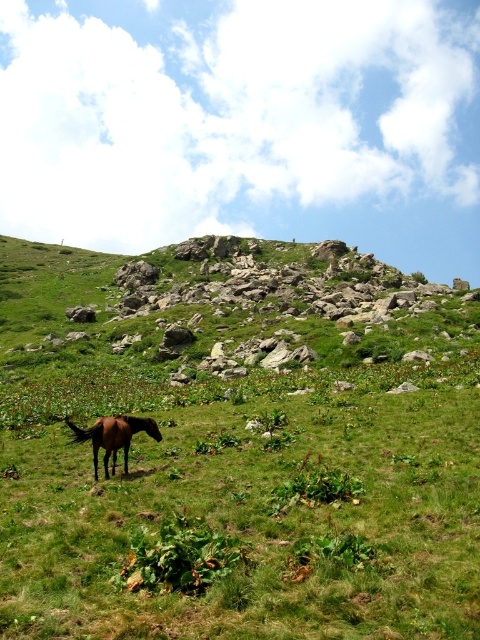
Is point (228, 324) positioned in front of point (116, 433)?

No, it is not.

Who is shorter, green grassy hillside at center or brown glossy horse at lower left?

brown glossy horse at lower left

Is point (63, 268) farther from camera compared to point (97, 429)?

Yes, point (63, 268) is behind point (97, 429).

Locate an element on the screen. The image size is (480, 640). green grassy hillside at center is located at coordinates (228, 314).